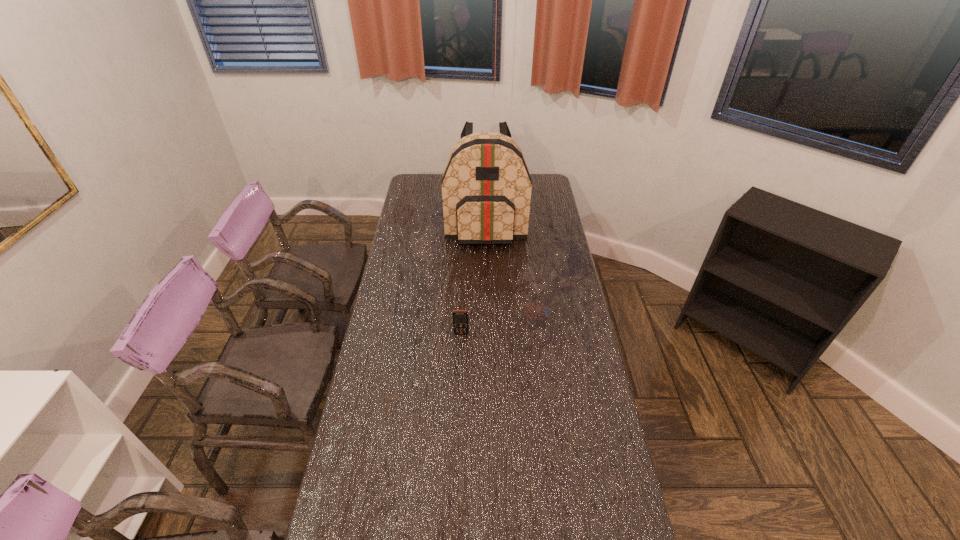
Where is `the tallest object`? The width and height of the screenshot is (960, 540). the tallest object is located at coordinates (486, 187).

Locate an element on the screen. This screenshot has height=540, width=960. backpack is located at coordinates (486, 187).

Locate an element on the screen. Image resolution: width=960 pixels, height=540 pixels. the second farthest object is located at coordinates (540, 276).

I want to click on the second shortest object, so click(x=540, y=276).

The width and height of the screenshot is (960, 540). What are the coordinates of `the shortest object` in the screenshot? It's located at (460, 317).

Locate an element on the screen. The height and width of the screenshot is (540, 960). cellular telephone is located at coordinates (460, 317).

Where is `vacant space located on the front face of the tallest object`? vacant space located on the front face of the tallest object is located at coordinates (487, 303).

The height and width of the screenshot is (540, 960). I want to click on vacant position located on the front of the second shortest object, so click(x=542, y=350).

Identify the location of free location located 0.110m on the screen of the cellular telephone. The image size is (960, 540). (460, 359).

At what (x,y) coordinates should I click in order to perform the action: click on object located in the right edge section of the desktop. Please return your answer as a coordinate pair (x, y). Looking at the image, I should click on click(x=540, y=276).